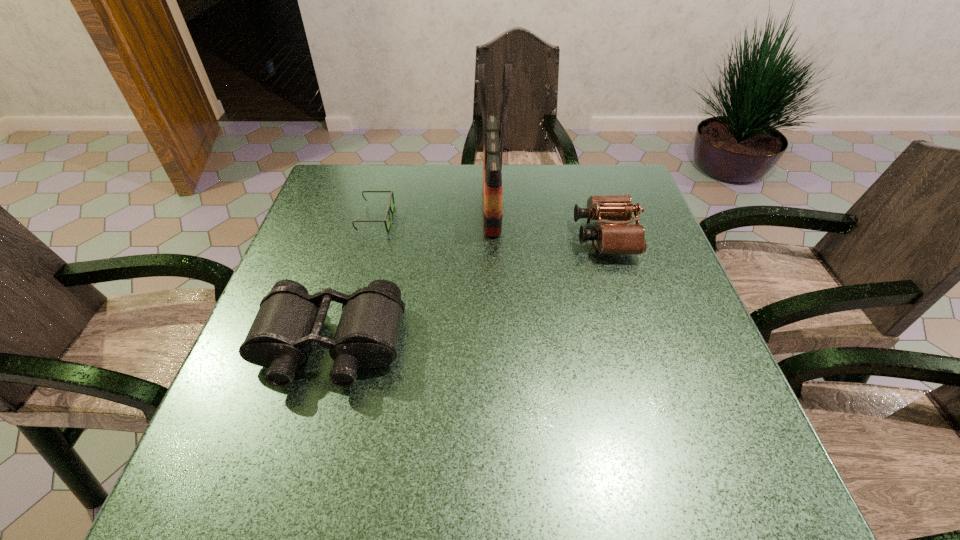
The image size is (960, 540). I want to click on blank space that satisfies the following two spatial constraints: 1. through the eyepieces of the farther binoculars; 2. through the eyepieces of the left binoculars, so click(639, 346).

Image resolution: width=960 pixels, height=540 pixels. Find the location of `free space in the image that satisfies the following two spatial constraints: 1. on the front-facing side of the shopping bag; 2. through the eyepieces of the nearer binoculars`. free space in the image that satisfies the following two spatial constraints: 1. on the front-facing side of the shopping bag; 2. through the eyepieces of the nearer binoculars is located at coordinates (496, 346).

The height and width of the screenshot is (540, 960). Identify the location of free spot that satisfies the following two spatial constraints: 1. on the front-facing side of the shopping bag; 2. through the eyepieces of the nearer binoculars. (496, 346).

The image size is (960, 540). In order to click on free location that satisfies the following two spatial constraints: 1. on the lens of the shortest object; 2. through the eyepieces of the nearer binoculars in this screenshot , I will do `click(342, 346)`.

Where is `vacant position in the image that satisfies the following two spatial constraints: 1. on the front-facing side of the shopping bag; 2. through the eyepieces of the nearest object`? The height and width of the screenshot is (540, 960). vacant position in the image that satisfies the following two spatial constraints: 1. on the front-facing side of the shopping bag; 2. through the eyepieces of the nearest object is located at coordinates (496, 346).

I want to click on vacant area that satisfies the following two spatial constraints: 1. on the front-facing side of the shopping bag; 2. through the eyepieces of the nearer binoculars, so click(496, 346).